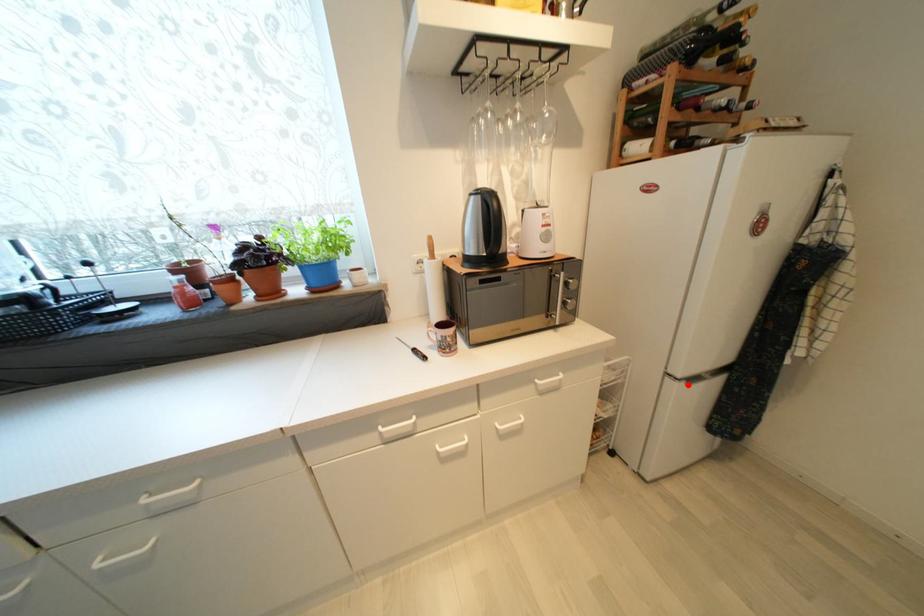
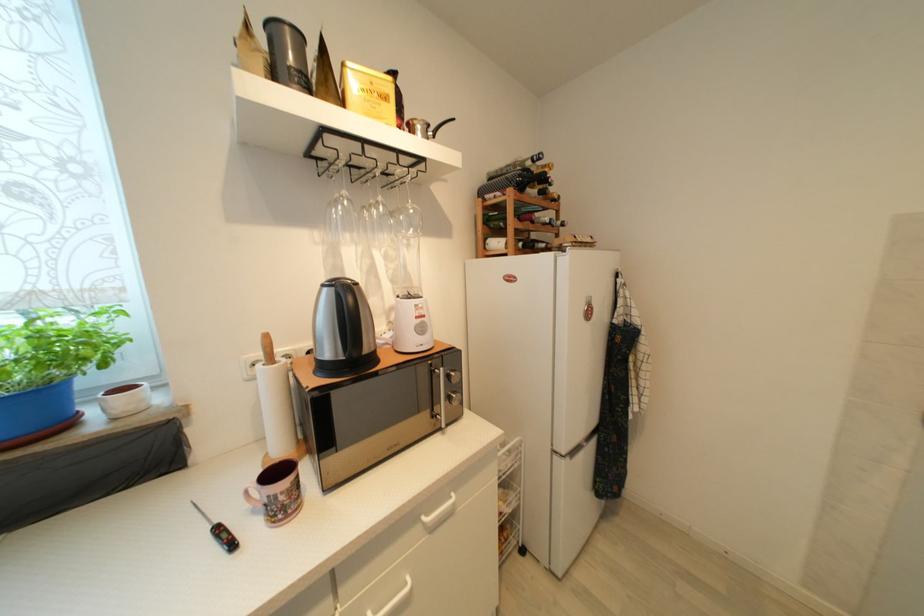
Find the pixel in the second image that matches the highlighted location in the first image.

(573, 461)